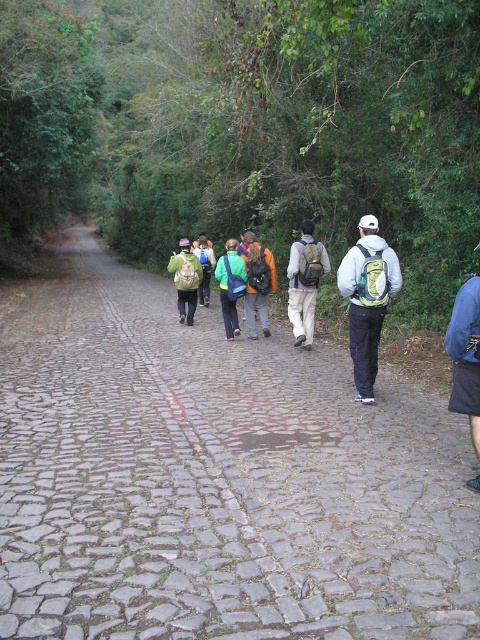
This screenshot has width=480, height=640. Describe the element at coordinates (215, 477) in the screenshot. I see `cobblestone path at center` at that location.

Can you confirm if cobblestone path at center is positioned below green matte backpack at center?

Yes.

Between point (187, 570) and point (197, 262), which one is positioned behind?

The point (197, 262) is more distant.

Identify the location of cobblestone path at center. (215, 477).

Is the position of orange fabric backpack at center more distant than that of green matte backpack at center?

No.

Is point (253, 332) less distant than point (180, 259)?

That is True.

Describe the element at coordinates (257, 282) in the screenshot. I see `orange fabric backpack at center` at that location.

Image resolution: width=480 pixels, height=640 pixels. Identify the location of orange fabric backpack at center. (257, 282).

Where is `orange fabric backpack at center`? orange fabric backpack at center is located at coordinates point(257,282).

Between point (265, 264) and point (228, 268), which one is positioned behind?

The point (228, 268) is behind.

The image size is (480, 640). Identify the location of orange fabric backpack at center. (257, 282).